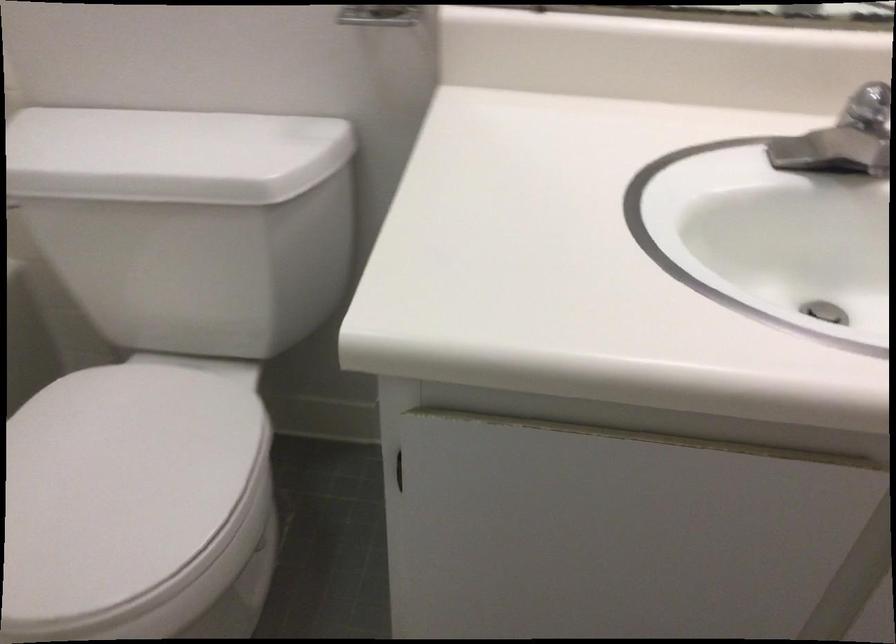
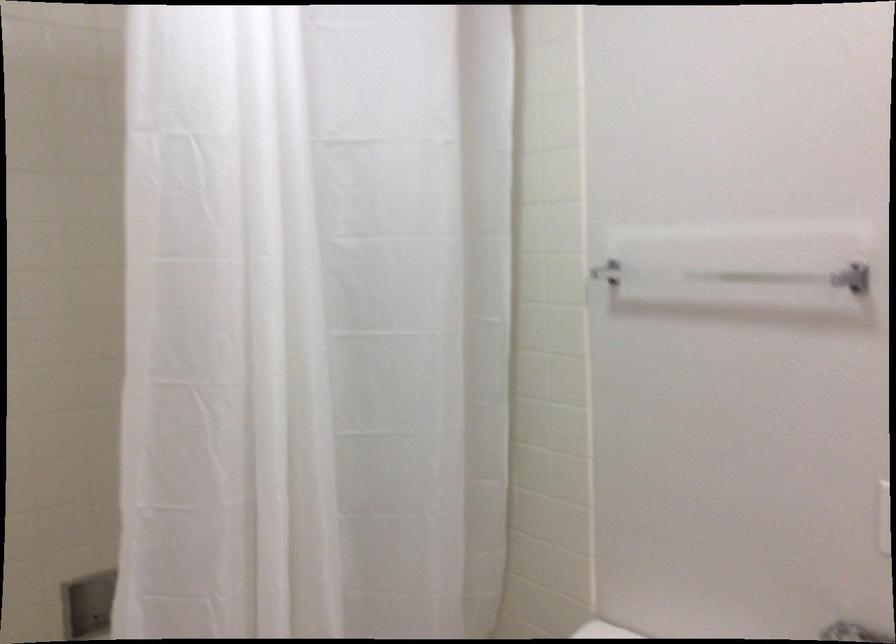
How did the camera likely rotate?

The camera's rotation is toward left-up.